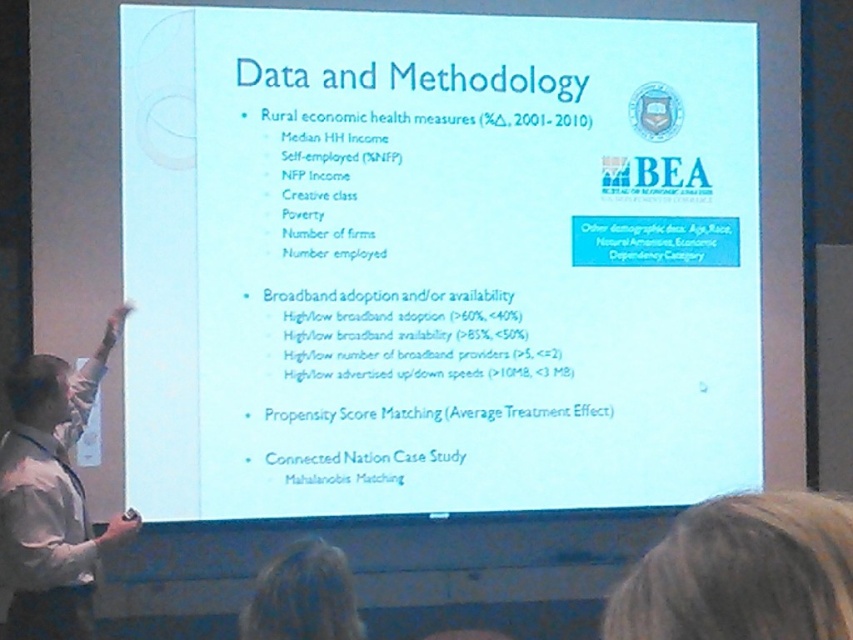
Question: Which point is closer to the camera?

Choices:
 (A) coord(643,438)
 (B) coord(349,582)
 (C) coord(74,605)
 (D) coord(712,538)

Answer: (D)

Question: Which object is the closest to the white paper at center?

Choices:
 (A) blonde hair at lower center
 (B) blonde hair at upper right
 (C) white shirt at left

Answer: (C)

Question: Observing the image, what is the correct spatial positioning of white paper at center in reference to white shirt at left?

Choices:
 (A) left
 (B) right

Answer: (B)

Question: Can you confirm if blonde hair at upper right is wider than white shirt at left?

Choices:
 (A) yes
 (B) no

Answer: (B)

Question: Which of the following is the closest to the observer?

Choices:
 (A) (613, 589)
 (B) (694, 154)
 (C) (310, 566)

Answer: (C)

Question: In this image, where is white paper at center located relative to blonde hair at lower center?

Choices:
 (A) above
 (B) below

Answer: (A)